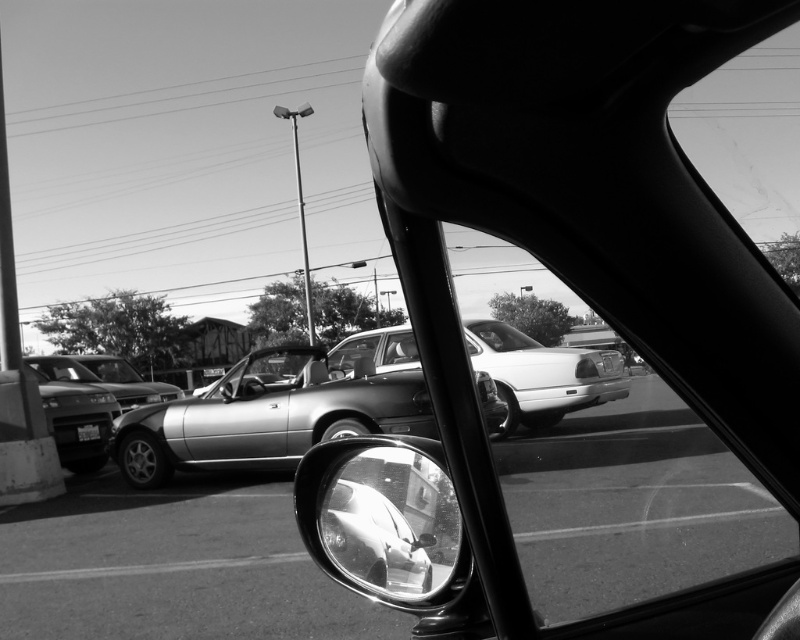
Which of these two, shiny chrome mirror at lower center or shiny silver convertible at center, stands shorter?

Standing shorter between the two is shiny chrome mirror at lower center.

Does shiny chrome mirror at lower center have a greater height compared to shiny silver convertible at center?

No, shiny chrome mirror at lower center is not taller than shiny silver convertible at center.

Locate an element on the screen. shiny chrome mirror at lower center is located at coordinates (384, 518).

Identify the location of shiny chrome mirror at lower center. The image size is (800, 640). (384, 518).

Which of these two, shiny metallic convertible at center or shiny silver sedan at left, stands taller?

shiny metallic convertible at center

Can you confirm if shiny metallic convertible at center is positioned below shiny silver sedan at left?

Incorrect, shiny metallic convertible at center is not positioned below shiny silver sedan at left.

Where is `shiny metallic convertible at center`? The height and width of the screenshot is (640, 800). shiny metallic convertible at center is located at coordinates (268, 416).

The height and width of the screenshot is (640, 800). I want to click on shiny metallic convertible at center, so click(x=268, y=416).

Between point (278, 416) and point (372, 552), which one is positioned in front?

Point (372, 552)

I want to click on shiny metallic convertible at center, so click(268, 416).